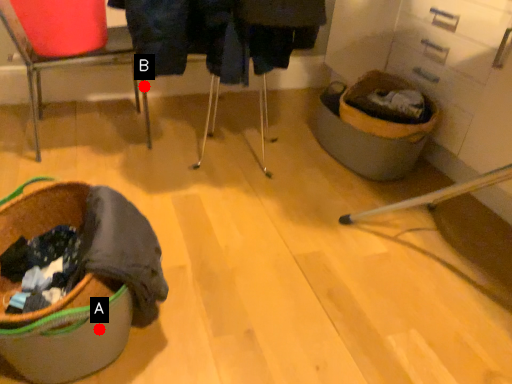
Question: Two points are circled on the image, labeled by A and B beside each circle. Which point is farther to the camera?

Choices:
 (A) A is further
 (B) B is further

Answer: (B)